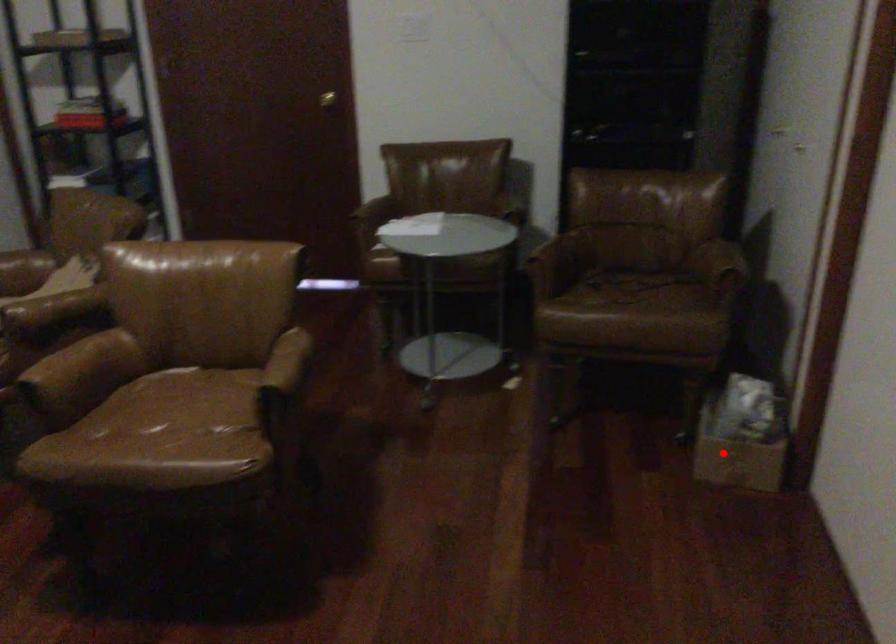
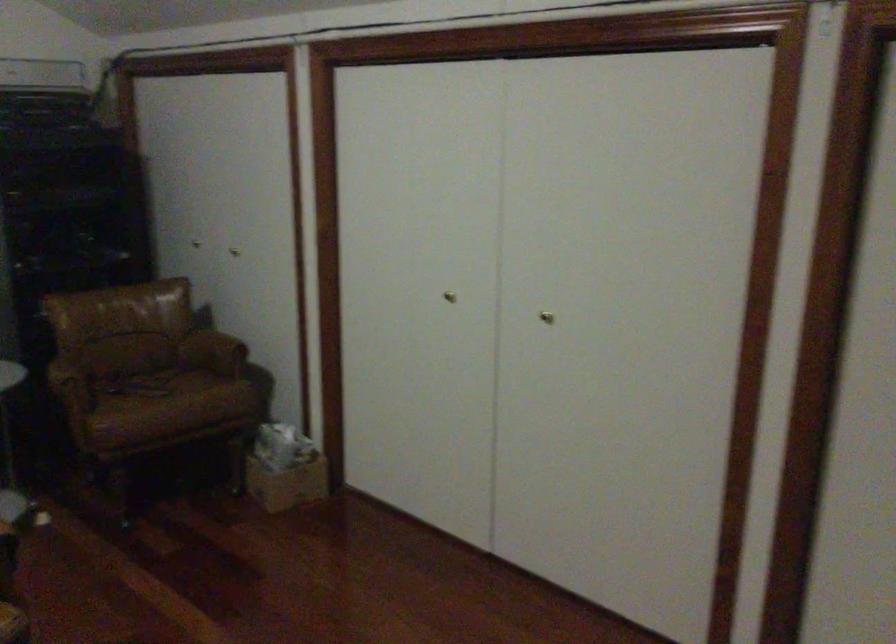
Question: A red point is marked in image1. In image2, is the corresponding 3D point closer to the camera or farther? Reply with the corresponding letter.

Choices:
 (A) The corresponding 3D point is closer.
 (B) The corresponding 3D point is farther.

Answer: (B)